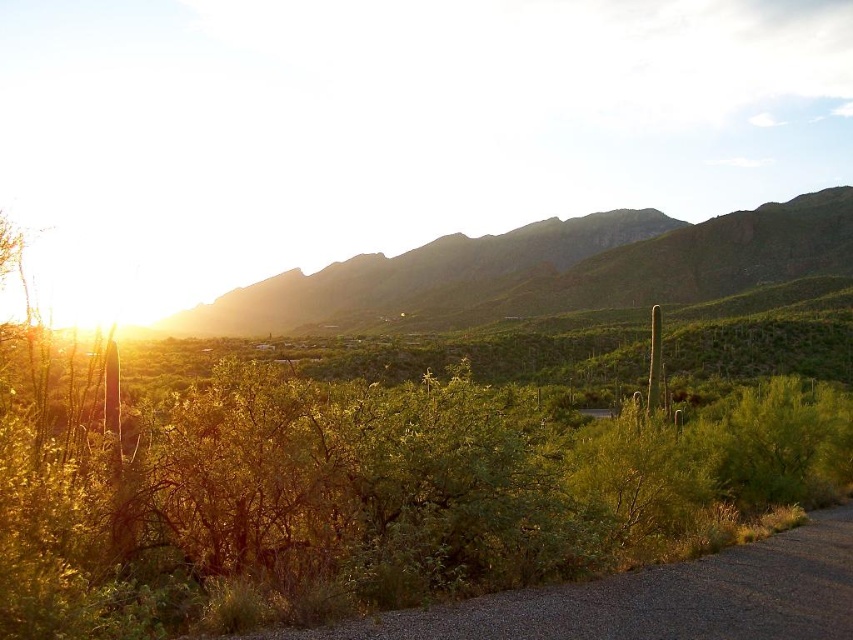
Can you confirm if green leafy bush at center is bigger than green rocky mountain at upper center?

Actually, green leafy bush at center might be smaller than green rocky mountain at upper center.

Between green leafy bush at center and green rocky mountain at upper center, which one has more height?

With more height is green rocky mountain at upper center.

Does point (140, 476) lie in front of point (688, 252)?

Yes.

Where is `green leafy bush at center`? green leafy bush at center is located at coordinates (357, 490).